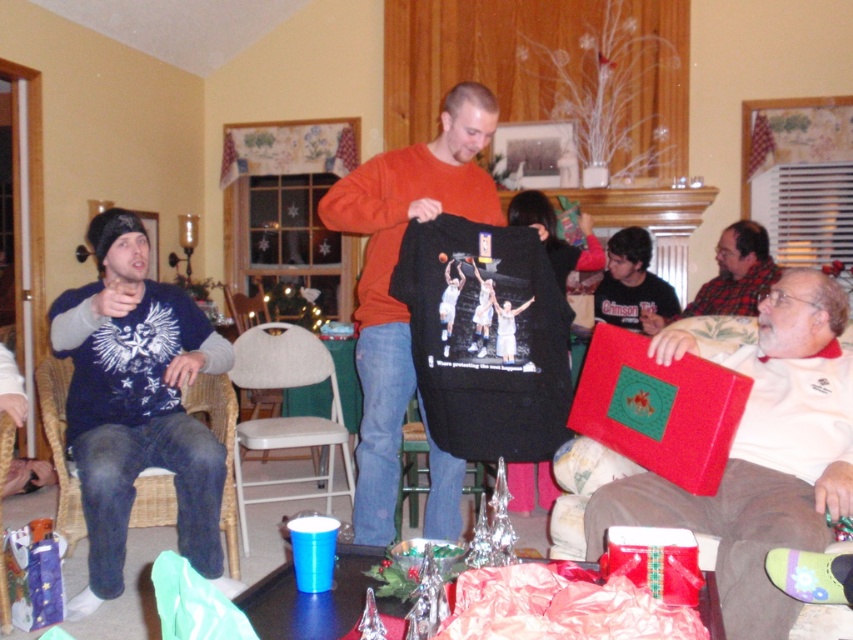
Question: Is crimson fabric shirt at center above green fabric chair at center?

Choices:
 (A) no
 (B) yes

Answer: (B)

Question: Which point is farther from the camera taking this photo?

Choices:
 (A) (22, 602)
 (B) (643, 316)
 (C) (346, 474)

Answer: (B)

Question: Which is nearer to the green fabric chair at center?

Choices:
 (A) wooden woven armchair at lower left
 (B) blue fabric wrapped gift at lower left
 (C) black matte t-shirt at center
 (D) blue cotton shirt at left

Answer: (C)

Question: Estimate the real-world distances between objects in this image. Which object is closer to the green fabric chair at center?

Choices:
 (A) crimson fabric shirt at center
 (B) black matte t-shirt at center
 (C) red matte gift bag at lower right
 (D) blue fabric wrapped gift at lower left

Answer: (B)

Question: Is black matte t-shirt at center thinner than wooden woven armchair at lower left?

Choices:
 (A) yes
 (B) no

Answer: (B)

Question: Can you confirm if blue cotton shirt at left is positioned to the right of blue fabric wrapped gift at lower left?

Choices:
 (A) no
 (B) yes

Answer: (B)